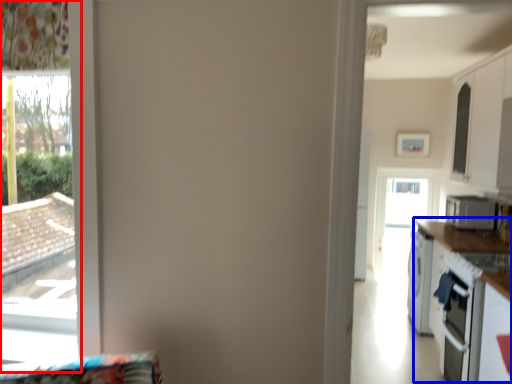
Question: Which point is further to the camera, window (highlighted by a red box) or counter top (highlighted by a blue box)?

Choices:
 (A) window
 (B) counter top

Answer: (B)